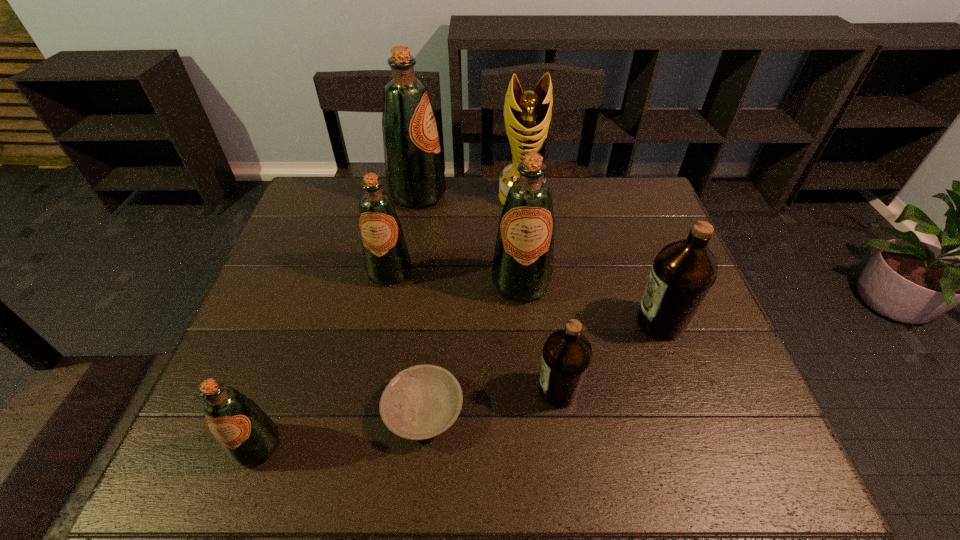
At what (x,y) coordinates should I click in order to perform the action: click on free spot between the biggest green olive oil and the leftmost object. Please return your answer as a coordinate pair (x, y). The height and width of the screenshot is (540, 960). Looking at the image, I should click on (337, 321).

Where is `free space between the bowl and the left brown olive oil`? free space between the bowl and the left brown olive oil is located at coordinates (491, 401).

The image size is (960, 540). Find the location of `vacant area that lies between the farthest olive oil and the leftmost object`. vacant area that lies between the farthest olive oil and the leftmost object is located at coordinates (337, 321).

Locate an element on the screen. unoccupied position between the shortest object and the second biggest green olive oil is located at coordinates (472, 347).

Image resolution: width=960 pixels, height=540 pixels. What are the coordinates of `the third closest object to the shortest object` in the screenshot? It's located at (522, 269).

The height and width of the screenshot is (540, 960). I want to click on object that is the fifth closest one to the award, so click(567, 355).

Select which olive oil appears as the fourth closest to the bowl. Please provide its 2D coordinates. Your answer should be formatted as a tuple, i.e. [(x, y)], where the tuple contains the x and y coordinates of a point satisfying the conditions above.

[(386, 258)]

Find the location of `olive oil object that ranks as the fourth closest to the second smallest green olive oil`. olive oil object that ranks as the fourth closest to the second smallest green olive oil is located at coordinates (567, 355).

Point out which green olive oil is positioned as the fourth nearest to the bowl. Please provide its 2D coordinates. Your answer should be formatted as a tuple, i.e. [(x, y)], where the tuple contains the x and y coordinates of a point satisfying the conditions above.

[(415, 178)]

Select which green olive oil appears as the second closest to the rightmost object. Please provide its 2D coordinates. Your answer should be formatted as a tuple, i.e. [(x, y)], where the tuple contains the x and y coordinates of a point satisfying the conditions above.

[(386, 258)]